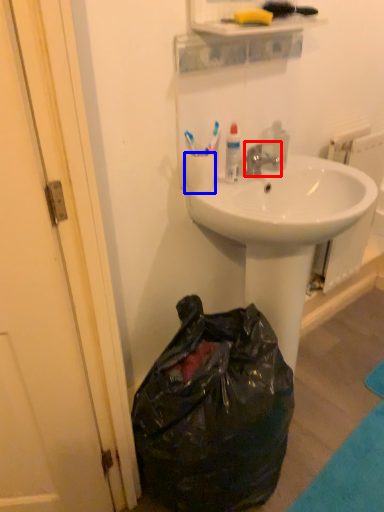
Question: Which of the following is the farthest to the observer, faucet (highlighted by a red box) or coffee cup (highlighted by a blue box)?

Choices:
 (A) faucet
 (B) coffee cup

Answer: (A)